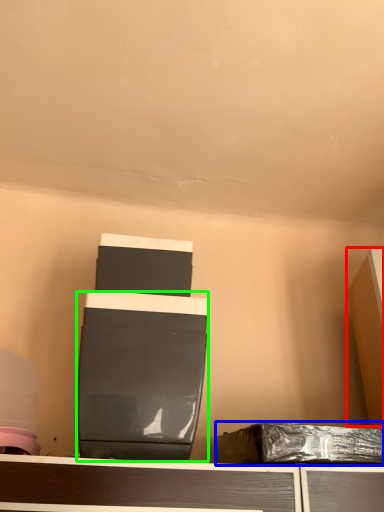
Question: Considering the real-world distances, which object is closest to furniture (highlighted by a red box)? waste (highlighted by a blue box) or wide (highlighted by a green box).

Choices:
 (A) waste
 (B) wide

Answer: (A)